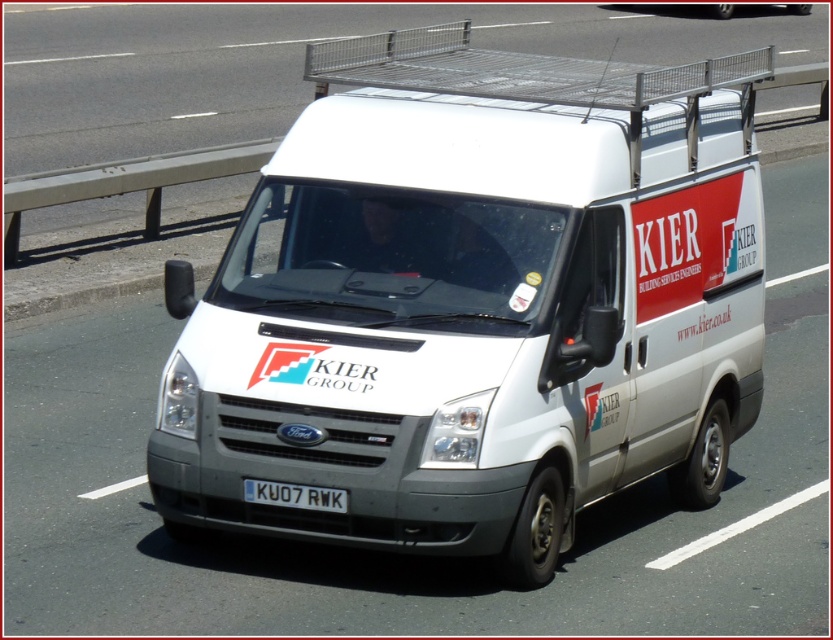
Question: Is white matte van at center below white plastic license plate at center?

Choices:
 (A) no
 (B) yes

Answer: (A)

Question: Which point is closer to the camera?

Choices:
 (A) white matte van at center
 (B) white van at center
 (C) white plastic license plate at center

Answer: (C)

Question: Does white matte van at center appear on the right side of white plastic license plate at center?

Choices:
 (A) yes
 (B) no

Answer: (A)

Question: Estimate the real-world distances between objects in this image. Which object is farther from the white matte van at center?

Choices:
 (A) white plastic license plate at center
 (B) white van at center

Answer: (B)

Question: Which point is farther from the camera taking this photo?

Choices:
 (A) (298, 493)
 (B) (166, 148)
 (C) (551, 291)

Answer: (B)

Question: Does white matte van at center appear on the right side of white van at center?

Choices:
 (A) no
 (B) yes

Answer: (B)